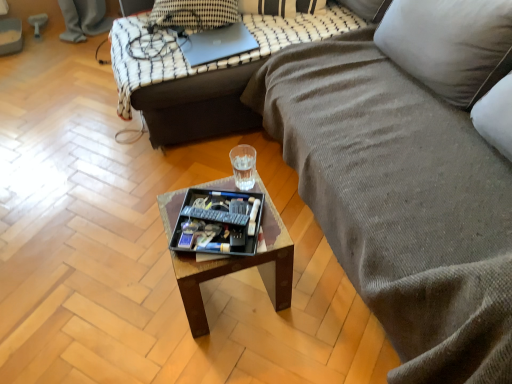
Find the location of a particular element. The height and width of the screenshot is (384, 512). free space above metallic gray swivel chair at upper left (from a real-world perspective) is located at coordinates (37, 21).